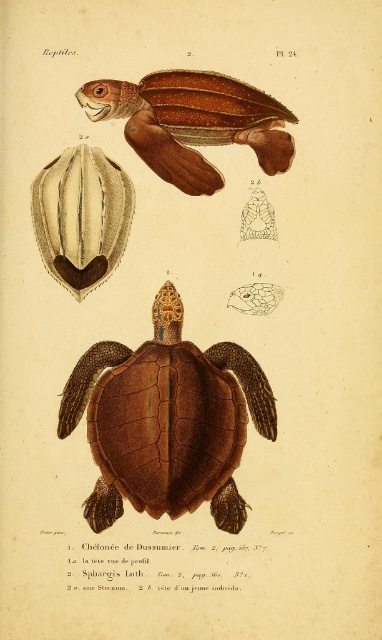
Question: Which point appears closest to the camera in this image?

Choices:
 (A) (241, 86)
 (B) (202, 380)

Answer: (A)

Question: Which point is farther to the camera?

Choices:
 (A) (273, 416)
 (B) (195, 88)

Answer: (A)

Question: Does brown matte/tough shell at center appear on the right side of brown glossy shell at upper center?

Choices:
 (A) yes
 (B) no

Answer: (B)

Question: Does brown matte/tough shell at center have a smaller size compared to brown glossy shell at upper center?

Choices:
 (A) no
 (B) yes

Answer: (A)

Question: Does brown matte/tough shell at center appear under brown glossy shell at upper center?

Choices:
 (A) yes
 (B) no

Answer: (A)